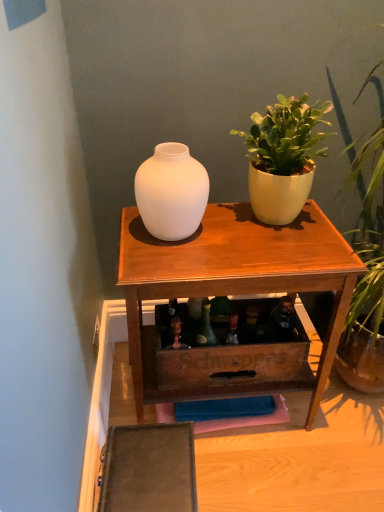
Question: Can you confirm if matte white vase at center is wider than matte white vase at upper center?

Choices:
 (A) yes
 (B) no

Answer: (B)

Question: Is matte white vase at center far away from matte white vase at upper center?

Choices:
 (A) yes
 (B) no

Answer: (B)

Question: Does matte white vase at center come behind matte white vase at upper center?

Choices:
 (A) yes
 (B) no

Answer: (B)

Question: Is matte white vase at center not within matte white vase at upper center?

Choices:
 (A) yes
 (B) no

Answer: (A)

Question: Considering the relative sizes of matte white vase at center and matte white vase at upper center in the image provided, is matte white vase at center smaller than matte white vase at upper center?

Choices:
 (A) no
 (B) yes

Answer: (B)

Question: Does matte white vase at center appear on the left side of matte white vase at upper center?

Choices:
 (A) no
 (B) yes

Answer: (B)

Question: Could you tell me if matte yellow pot at upper right is facing matte white vase at upper center?

Choices:
 (A) yes
 (B) no

Answer: (B)

Question: Considering the relative sizes of matte yellow pot at upper right and matte white vase at upper center in the image provided, is matte yellow pot at upper right bigger than matte white vase at upper center?

Choices:
 (A) yes
 (B) no

Answer: (B)

Question: From the image's perspective, is matte yellow pot at upper right under matte white vase at upper center?

Choices:
 (A) yes
 (B) no

Answer: (B)

Question: Considering the relative sizes of matte yellow pot at upper right and matte white vase at upper center in the image provided, is matte yellow pot at upper right taller than matte white vase at upper center?

Choices:
 (A) yes
 (B) no

Answer: (B)

Question: Are matte yellow pot at upper right and matte white vase at upper center far apart?

Choices:
 (A) yes
 (B) no

Answer: (B)

Question: Does matte yellow pot at upper right lie behind matte white vase at upper center?

Choices:
 (A) no
 (B) yes

Answer: (A)

Question: From a real-world perspective, is matte white vase at center over matte yellow pot at upper right?

Choices:
 (A) no
 (B) yes

Answer: (A)